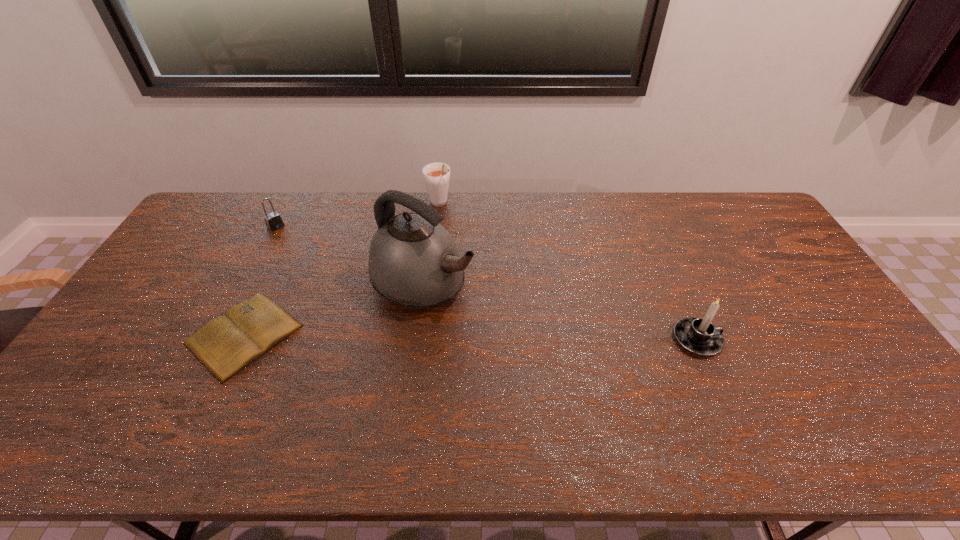
The image size is (960, 540). What are the coordinates of `vacant spot on the desktop that is between the book and the candle holder and is positioned at the spout of the tallest object` in the screenshot? It's located at (526, 338).

The image size is (960, 540). In order to click on vacant space on the desktop that is between the shortest object and the candle holder and is positioned on the drink side of the farthest object in this screenshot , I will do `click(524, 338)`.

Locate an element on the screen. The width and height of the screenshot is (960, 540). vacant spot on the desktop that is between the shortest object and the candle holder and is positioned on the shackle of the second farthest object is located at coordinates (403, 336).